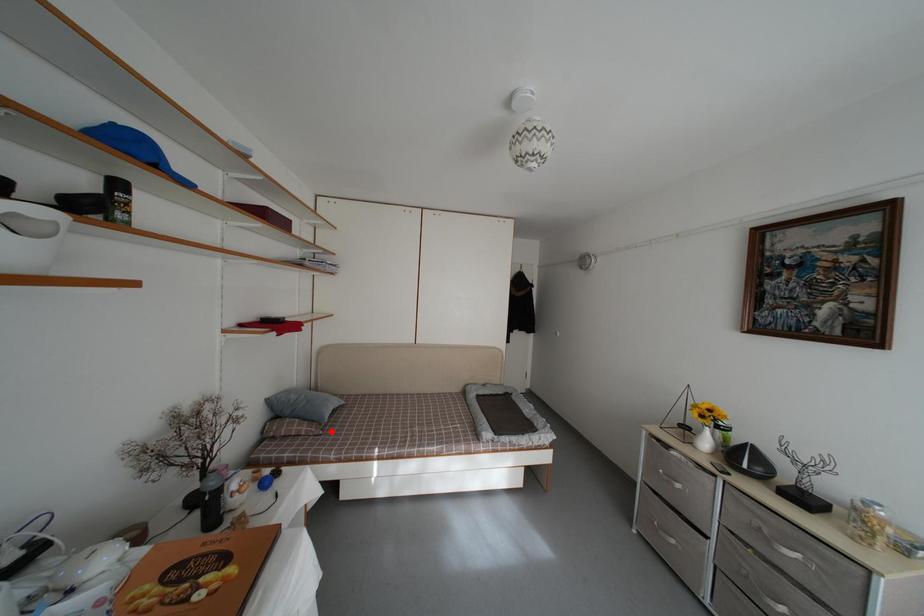
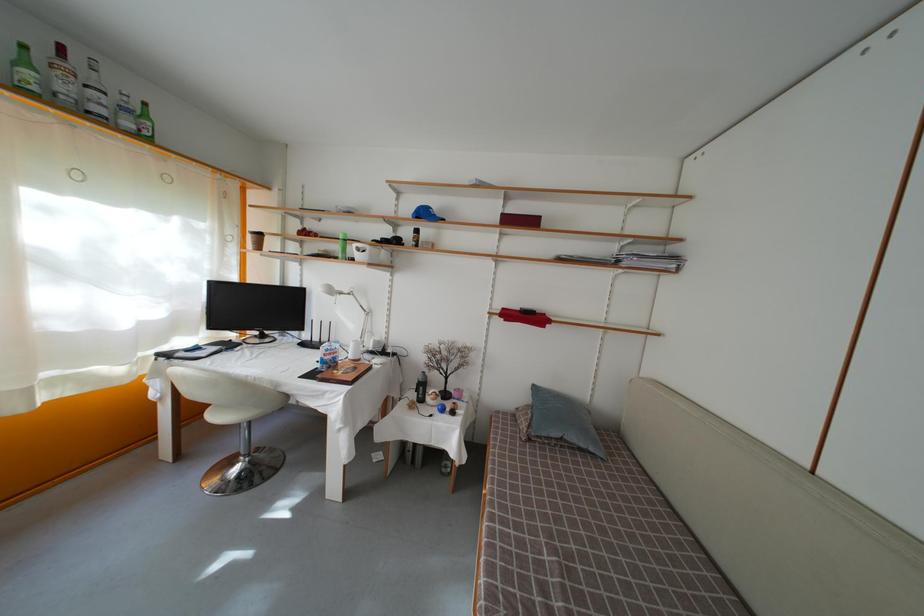
Where in the second image is the point corresponding to the highlighted location from the first image?

(550, 450)